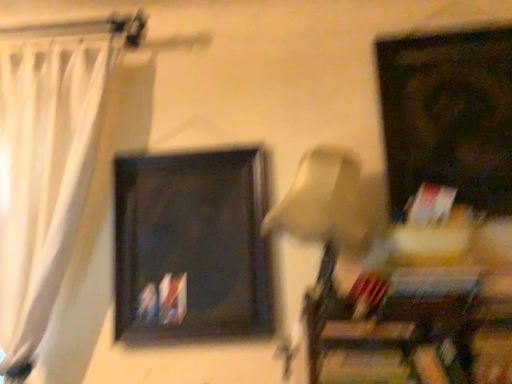
Question: Considering the relative positions of beige fabric lampshade at center and matte black picture frame at upper right, which appears as the 2th picture frame when viewed from the left, in the image provided, is beige fabric lampshade at center to the left of matte black picture frame at upper right, which appears as the 2th picture frame when viewed from the left, from the viewer's perspective?

Choices:
 (A) yes
 (B) no

Answer: (A)

Question: Would you say beige fabric lampshade at center is outside matte black picture frame at upper right, which appears as the 2th picture frame when viewed from the left?

Choices:
 (A) no
 (B) yes

Answer: (B)

Question: Is beige fabric lampshade at center far away from matte black picture frame at upper right, which ranks as the 1th picture frame in right-to-left order?

Choices:
 (A) no
 (B) yes

Answer: (A)

Question: From the image's perspective, is beige fabric lampshade at center located beneath matte black picture frame at upper right, which appears as the 2th picture frame when viewed from the left?

Choices:
 (A) no
 (B) yes

Answer: (B)

Question: Can you confirm if beige fabric lampshade at center is thinner than matte black picture frame at upper right, which appears as the 2th picture frame when viewed from the left?

Choices:
 (A) no
 (B) yes

Answer: (A)

Question: Could you tell me if beige fabric lampshade at center is facing matte black picture frame at upper right, which appears as the 2th picture frame when viewed from the left?

Choices:
 (A) no
 (B) yes

Answer: (A)

Question: Is white sheer curtain at left positioned beyond the bounds of matte black picture frame at upper right, which ranks as the 1th picture frame in right-to-left order?

Choices:
 (A) yes
 (B) no

Answer: (A)

Question: Does white sheer curtain at left appear on the right side of matte black picture frame at upper right, which appears as the 2th picture frame when viewed from the left?

Choices:
 (A) no
 (B) yes

Answer: (A)

Question: Is white sheer curtain at left thinner than matte black picture frame at upper right, which appears as the 2th picture frame when viewed from the left?

Choices:
 (A) no
 (B) yes

Answer: (A)

Question: From the image's perspective, is white sheer curtain at left located beneath matte black picture frame at upper right, which appears as the 2th picture frame when viewed from the left?

Choices:
 (A) no
 (B) yes

Answer: (B)

Question: Is the surface of white sheer curtain at left in direct contact with matte black picture frame at upper right, which appears as the 2th picture frame when viewed from the left?

Choices:
 (A) yes
 (B) no

Answer: (B)

Question: Does white sheer curtain at left have a larger size compared to matte black picture frame at upper right, which appears as the 2th picture frame when viewed from the left?

Choices:
 (A) yes
 (B) no

Answer: (A)

Question: Can you confirm if matte black picture frame at upper right, which appears as the 2th picture frame when viewed from the left, is shorter than beige fabric lampshade at center?

Choices:
 (A) yes
 (B) no

Answer: (B)